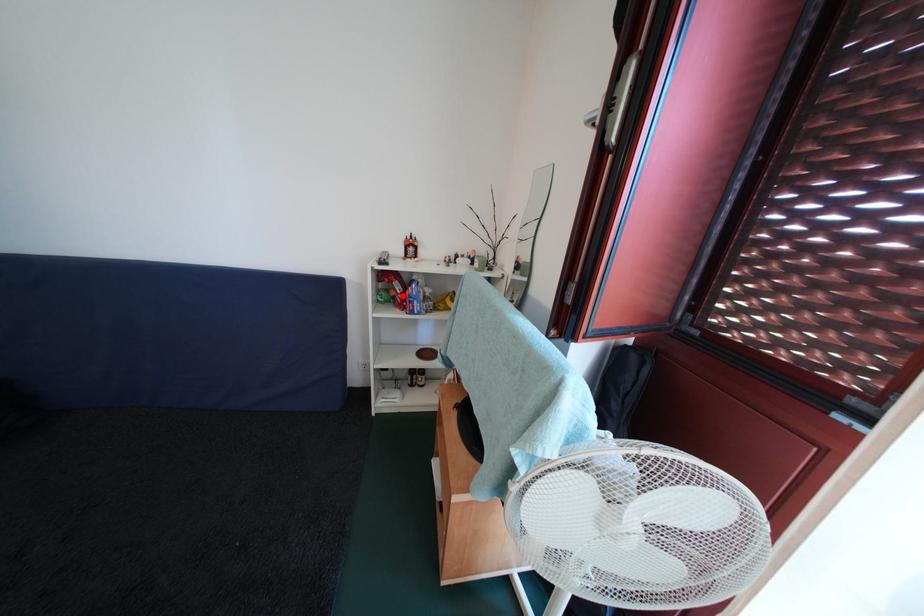
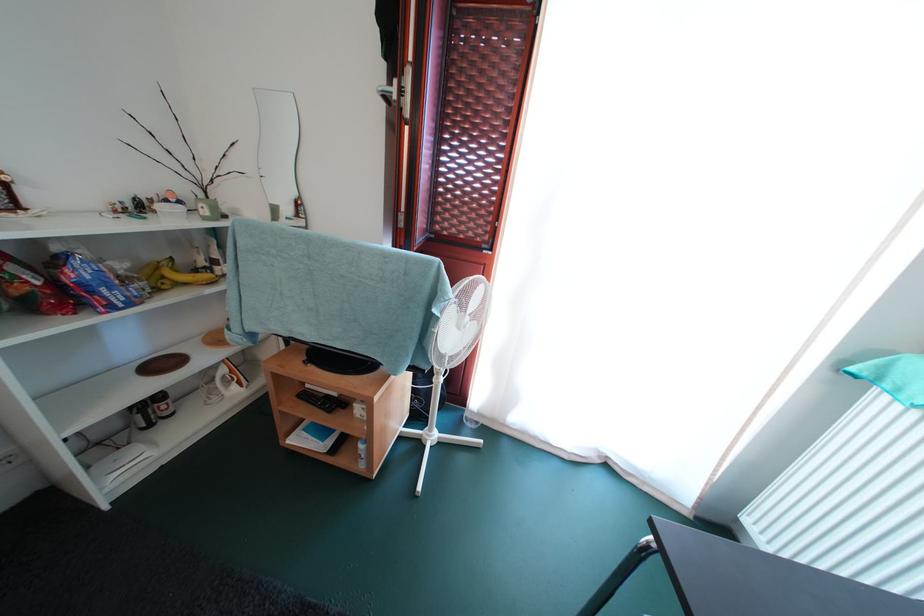
The point at the highlighted location is marked in the first image. Where is the corresponding point in the second image?

(34, 286)